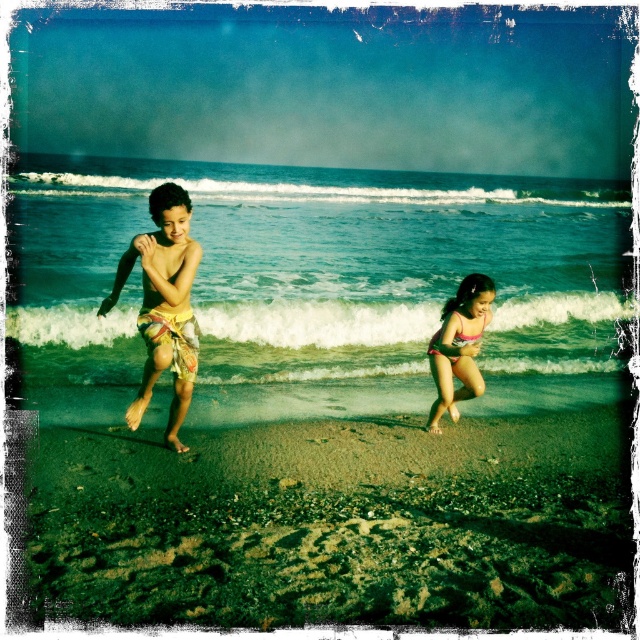
Question: Can you confirm if brown sandy beach at lower center is thinner than yellow patterned sarong at left?

Choices:
 (A) no
 (B) yes

Answer: (A)

Question: Does brown sandy beach at lower center appear over yellow patterned sarong at left?

Choices:
 (A) yes
 (B) no

Answer: (B)

Question: Does yellow patterned sarong at left appear on the left side of pink fabric swimsuit at right?

Choices:
 (A) yes
 (B) no

Answer: (A)

Question: Which point is closer to the camera?

Choices:
 (A) pink fabric swimsuit at right
 (B) blue water at center

Answer: (A)

Question: Which object is the farthest from the yellow patterned sarong at left?

Choices:
 (A) pink fabric swimsuit at right
 (B) brown sandy beach at lower center

Answer: (A)

Question: Which point is farther to the camera?

Choices:
 (A) (451, 339)
 (B) (588, 452)

Answer: (B)